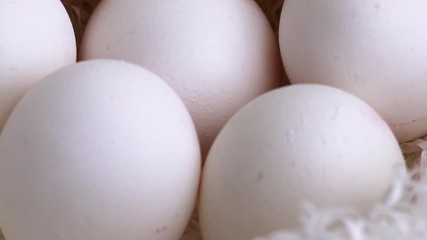
Find the location of a particular element. light pink shade is located at coordinates (207, 100).